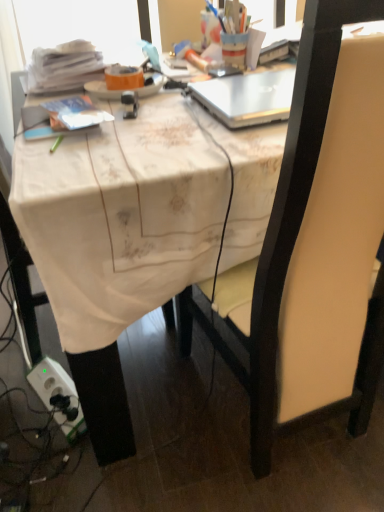
Locate an element on the screen. Image resolution: width=384 pixels, height=512 pixels. free space above orange matte plate at upper center (from a real-world perspective) is located at coordinates (131, 78).